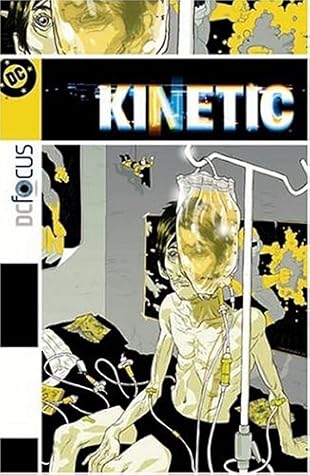
Find the location of a particular element. Image resolution: width=310 pixels, height=475 pixels. black sheets on bed is located at coordinates (138, 365), (147, 362).